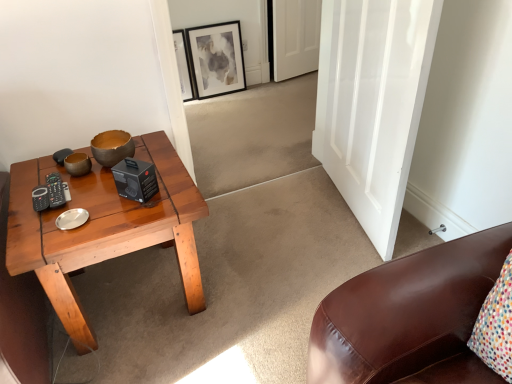
Find the location of a particular element. empty space that is in between wooden coffee table at left and white glossy door at center, the second door when ordered from back to front is located at coordinates (271, 246).